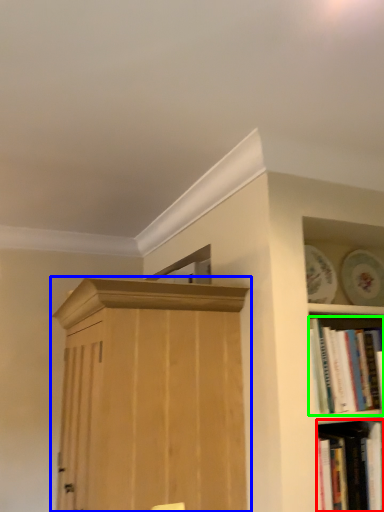
Question: Which object is positioned closest to book (highlighted by a red box)? Select from cupboard (highlighted by a blue box) and book (highlighted by a green box).

Choices:
 (A) cupboard
 (B) book

Answer: (B)